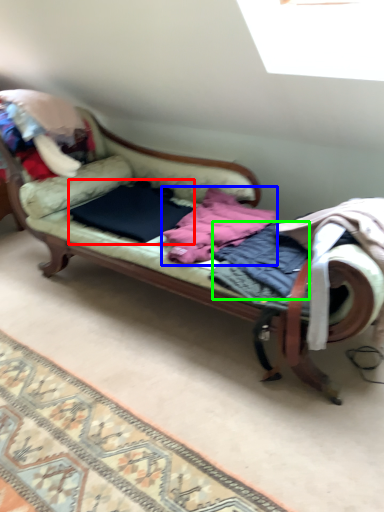
Question: Which object is the closest to the clothing (highlighted by a red box)? Choose among these: clothing (highlighted by a blue box) or clothing (highlighted by a green box).

Choices:
 (A) clothing
 (B) clothing

Answer: (A)